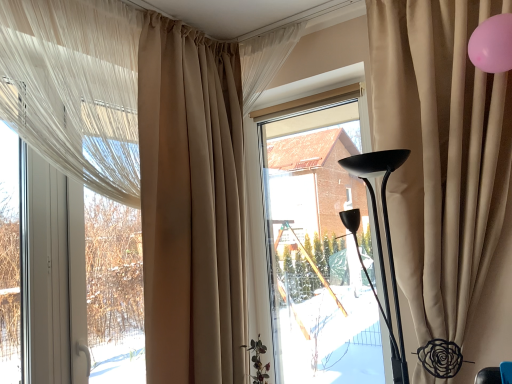
Describe the element at coordinates (313, 241) in the screenshot. This screenshot has height=384, width=512. I see `transparent glass window at center` at that location.

Measure the distance between beige fabric curtain at upper center, which ranks as the 2th curtain in right-to-left order, and camera.

The depth of beige fabric curtain at upper center, which ranks as the 2th curtain in right-to-left order, is 2.15 meters.

The image size is (512, 384). What do you see at coordinates (75, 88) in the screenshot?
I see `translucent white curtain at left, marked as the first curtain in a left-to-right arrangement` at bounding box center [75, 88].

You are a GUI agent. You are given a task and a screenshot of the screen. Output one action in this format:
    pyautogui.click(x=<x>, y=<y>)
    Task: Click on the translucent white curtain at left, marked as the first curtain in a left-to-right arrangement
    Image resolution: width=512 pixels, height=384 pixels.
    Given the screenshot: What is the action you would take?
    pyautogui.click(x=75, y=88)

How much space does beige fabric curtain at left, placed as the 3th curtain when sorted from right to left, occupy horizontally?

beige fabric curtain at left, placed as the 3th curtain when sorted from right to left, is 8.47 inches wide.

You are a GUI agent. You are given a task and a screenshot of the screen. Output one action in this format:
    pyautogui.click(x=<x>, y=<y>)
    Task: Click on the beige velvet curtain at right, the 1th curtain positioned from the right
    The image size is (512, 384).
    Given the screenshot: What is the action you would take?
    pyautogui.click(x=440, y=154)

In terms of height, does translucent white curtain at left, which is the fourth curtain in right-to-left order, look taller or shorter compared to transparent glass window at center?

In the image, translucent white curtain at left, which is the fourth curtain in right-to-left order, appears to be shorter than transparent glass window at center.

Is translucent white curtain at left, marked as the first curtain in a left-to-right arrangement, inside the boundaries of transparent glass window at center, or outside?

translucent white curtain at left, marked as the first curtain in a left-to-right arrangement, cannot be found inside transparent glass window at center.

Is translucent white curtain at left, which is the fourth curtain in right-to-left order, in front of transparent glass window at center?

Yes, it is in front of transparent glass window at center.

Measure the distance between translucent white curtain at left, which is the fourth curtain in right-to-left order, and beige fabric curtain at upper center, acting as the third curtain starting from the left.

A distance of 30.78 inches exists between translucent white curtain at left, which is the fourth curtain in right-to-left order, and beige fabric curtain at upper center, acting as the third curtain starting from the left.

Is translucent white curtain at left, marked as the first curtain in a left-to-right arrangement, positioned beyond the bounds of beige fabric curtain at upper center, acting as the third curtain starting from the left?

translucent white curtain at left, marked as the first curtain in a left-to-right arrangement, lies outside beige fabric curtain at upper center, acting as the third curtain starting from the left,'s area.

Is translucent white curtain at left, which is the fourth curtain in right-to-left order, aimed at beige fabric curtain at upper center, acting as the third curtain starting from the left?

No.

Based on the photo, is translucent white curtain at left, which is the fourth curtain in right-to-left order, wider or thinner than beige fabric curtain at upper center, which ranks as the 2th curtain in right-to-left order?

translucent white curtain at left, which is the fourth curtain in right-to-left order, is thinner than beige fabric curtain at upper center, which ranks as the 2th curtain in right-to-left order.

Consider the image. Is translucent white curtain at left, which is the fourth curtain in right-to-left order, thinner than beige fabric curtain at left, the 2th curtain when ordered from left to right?

Correct, the width of translucent white curtain at left, which is the fourth curtain in right-to-left order, is less than that of beige fabric curtain at left, the 2th curtain when ordered from left to right.

Starting from the beige fabric curtain at left, placed as the 3th curtain when sorted from right to left, which curtain is the 2nd one in front? Please provide its 2D coordinates.

[(75, 88)]

Is translucent white curtain at left, which is the fourth curtain in right-to-left order, oriented towards beige fabric curtain at left, placed as the 3th curtain when sorted from right to left?

No, translucent white curtain at left, which is the fourth curtain in right-to-left order, is not turned towards beige fabric curtain at left, placed as the 3th curtain when sorted from right to left.

Is point (39, 124) positioned in front of point (239, 59)?

Yes, point (39, 124) is closer to viewer.

Looking at this image, based on their sizes in the image, would you say transparent glass window at center is bigger or smaller than translucent white curtain at left, marked as the first curtain in a left-to-right arrangement?

In the image, transparent glass window at center appears to be larger than translucent white curtain at left, marked as the first curtain in a left-to-right arrangement.

Is transparent glass window at center inside or outside of translucent white curtain at left, which is the fourth curtain in right-to-left order?

transparent glass window at center is located beyond the bounds of translucent white curtain at left, which is the fourth curtain in right-to-left order.

In the scene shown: Considering the sizes of transparent glass window at center and translucent white curtain at left, marked as the first curtain in a left-to-right arrangement, in the image, is transparent glass window at center wider or thinner than translucent white curtain at left, marked as the first curtain in a left-to-right arrangement,?

transparent glass window at center is thinner than translucent white curtain at left, marked as the first curtain in a left-to-right arrangement.

Considering the points (327, 96) and (1, 36), which point is behind, point (327, 96) or point (1, 36)?

The point (327, 96) is behind.

Considering the relative sizes of beige fabric curtain at left, the 2th curtain when ordered from left to right, and translucent white curtain at left, which is the fourth curtain in right-to-left order, in the image provided, is beige fabric curtain at left, the 2th curtain when ordered from left to right, shorter than translucent white curtain at left, which is the fourth curtain in right-to-left order,?

No, beige fabric curtain at left, the 2th curtain when ordered from left to right, is not shorter than translucent white curtain at left, which is the fourth curtain in right-to-left order.

Is beige fabric curtain at left, placed as the 3th curtain when sorted from right to left, next to translucent white curtain at left, which is the fourth curtain in right-to-left order?

No, beige fabric curtain at left, placed as the 3th curtain when sorted from right to left, is not in contact with translucent white curtain at left, which is the fourth curtain in right-to-left order.

From the image's perspective, which curtain is the 2nd one below the translucent white curtain at left, which is the fourth curtain in right-to-left order? Please provide its 2D coordinates.

[(191, 204)]

Between beige fabric curtain at left, the 2th curtain when ordered from left to right, and translucent white curtain at left, which is the fourth curtain in right-to-left order, which one is positioned in front?

translucent white curtain at left, which is the fourth curtain in right-to-left order, is closer to the camera.

Which is closer, (458, 156) or (214, 262)?

Point (458, 156)

From the image's perspective, is beige velvet curtain at right, acting as the 4th curtain starting from the left, located above or below beige fabric curtain at left, placed as the 3th curtain when sorted from right to left?

From the image's perspective, beige velvet curtain at right, acting as the 4th curtain starting from the left, appears above beige fabric curtain at left, placed as the 3th curtain when sorted from right to left.

How many degrees apart are the facing directions of beige velvet curtain at right, acting as the 4th curtain starting from the left, and beige fabric curtain at left, placed as the 3th curtain when sorted from right to left?

The angular difference between beige velvet curtain at right, acting as the 4th curtain starting from the left, and beige fabric curtain at left, placed as the 3th curtain when sorted from right to left, is 93.3 degrees.

Considering the positions of objects beige velvet curtain at right, acting as the 4th curtain starting from the left, and beige fabric curtain at left, the 2th curtain when ordered from left to right, in the image provided, who is more to the right, beige velvet curtain at right, acting as the 4th curtain starting from the left, or beige fabric curtain at left, the 2th curtain when ordered from left to right,?

Positioned to the right is beige velvet curtain at right, acting as the 4th curtain starting from the left.

In the scene shown: Are beige velvet curtain at right, acting as the 4th curtain starting from the left, and translucent white curtain at left, marked as the first curtain in a left-to-right arrangement, making contact?

No, beige velvet curtain at right, acting as the 4th curtain starting from the left, is not making contact with translucent white curtain at left, marked as the first curtain in a left-to-right arrangement.

Which object is wider, beige velvet curtain at right, acting as the 4th curtain starting from the left, or translucent white curtain at left, which is the fourth curtain in right-to-left order?

A: beige velvet curtain at right, acting as the 4th curtain starting from the left.

Does beige velvet curtain at right, acting as the 4th curtain starting from the left, have a smaller size compared to translucent white curtain at left, which is the fourth curtain in right-to-left order?

No.

From the image's perspective, starting from the transparent glass window at center, which curtain is the 3rd one above? Please provide its 2D coordinates.

[(75, 88)]

Identify the location of the 1st curtain below the beige fabric curtain at upper center, acting as the third curtain starting from the left (from a real-world perspective). This screenshot has width=512, height=384. (75, 88).

Consider the image. When comparing their distances from beige fabric curtain at upper center, acting as the third curtain starting from the left, does translucent white curtain at left, marked as the first curtain in a left-to-right arrangement, or transparent glass window at center seem further?

Based on the image, transparent glass window at center appears to be further to beige fabric curtain at upper center, acting as the third curtain starting from the left.

Which object lies further to the anchor point beige velvet curtain at right, the 1th curtain positioned from the right, translucent white curtain at left, which is the fourth curtain in right-to-left order, or transparent glass window at center?

Among the two, translucent white curtain at left, which is the fourth curtain in right-to-left order, is located further to beige velvet curtain at right, the 1th curtain positioned from the right.

Considering their positions, is beige fabric curtain at left, the 2th curtain when ordered from left to right, positioned further to translucent white curtain at left, which is the fourth curtain in right-to-left order, than beige fabric curtain at upper center, acting as the third curtain starting from the left?

beige fabric curtain at upper center, acting as the third curtain starting from the left, is further to translucent white curtain at left, which is the fourth curtain in right-to-left order.

Considering their positions, is beige velvet curtain at right, the 1th curtain positioned from the right, positioned closer to beige fabric curtain at upper center, acting as the third curtain starting from the left, than beige fabric curtain at left, the 2th curtain when ordered from left to right?

beige fabric curtain at left, the 2th curtain when ordered from left to right, is closer to beige fabric curtain at upper center, acting as the third curtain starting from the left.

Looking at the image, which one is located closer to beige fabric curtain at upper center, which ranks as the 2th curtain in right-to-left order, beige fabric curtain at left, placed as the 3th curtain when sorted from right to left, or translucent white curtain at left, marked as the first curtain in a left-to-right arrangement?

Among the two, beige fabric curtain at left, placed as the 3th curtain when sorted from right to left, is located nearer to beige fabric curtain at upper center, which ranks as the 2th curtain in right-to-left order.

Consider the image. Based on their spatial positions, is translucent white curtain at left, which is the fourth curtain in right-to-left order, or beige fabric curtain at left, the 2th curtain when ordered from left to right, further from beige fabric curtain at upper center, which ranks as the 2th curtain in right-to-left order?

translucent white curtain at left, which is the fourth curtain in right-to-left order, is positioned further to the anchor beige fabric curtain at upper center, which ranks as the 2th curtain in right-to-left order.

Which object lies further to the anchor point transparent glass window at center, translucent white curtain at left, marked as the first curtain in a left-to-right arrangement, or beige fabric curtain at left, placed as the 3th curtain when sorted from right to left?

translucent white curtain at left, marked as the first curtain in a left-to-right arrangement, is positioned further to the anchor transparent glass window at center.

When comparing their distances from beige fabric curtain at left, the 2th curtain when ordered from left to right, does translucent white curtain at left, marked as the first curtain in a left-to-right arrangement, or beige velvet curtain at right, acting as the 4th curtain starting from the left, seem further?

Among the two, beige velvet curtain at right, acting as the 4th curtain starting from the left, is located further to beige fabric curtain at left, the 2th curtain when ordered from left to right.

Where is `window between translucent white curtain at left, which is the fourth curtain in right-to-left order, and beige velvet curtain at right, acting as the 4th curtain starting from the left`? window between translucent white curtain at left, which is the fourth curtain in right-to-left order, and beige velvet curtain at right, acting as the 4th curtain starting from the left is located at coordinates (313, 241).

The height and width of the screenshot is (384, 512). What are the coordinates of `window between beige fabric curtain at left, placed as the 3th curtain when sorted from right to left, and beige velvet curtain at right, the 1th curtain positioned from the right, from left to right` in the screenshot? It's located at click(313, 241).

Find the location of a particular element. The width and height of the screenshot is (512, 384). curtain situated between translucent white curtain at left, which is the fourth curtain in right-to-left order, and beige fabric curtain at upper center, which ranks as the 2th curtain in right-to-left order, from left to right is located at coordinates (191, 204).

I want to click on curtain located between beige fabric curtain at left, placed as the 3th curtain when sorted from right to left, and beige velvet curtain at right, the 1th curtain positioned from the right, in the left-right direction, so click(x=265, y=60).